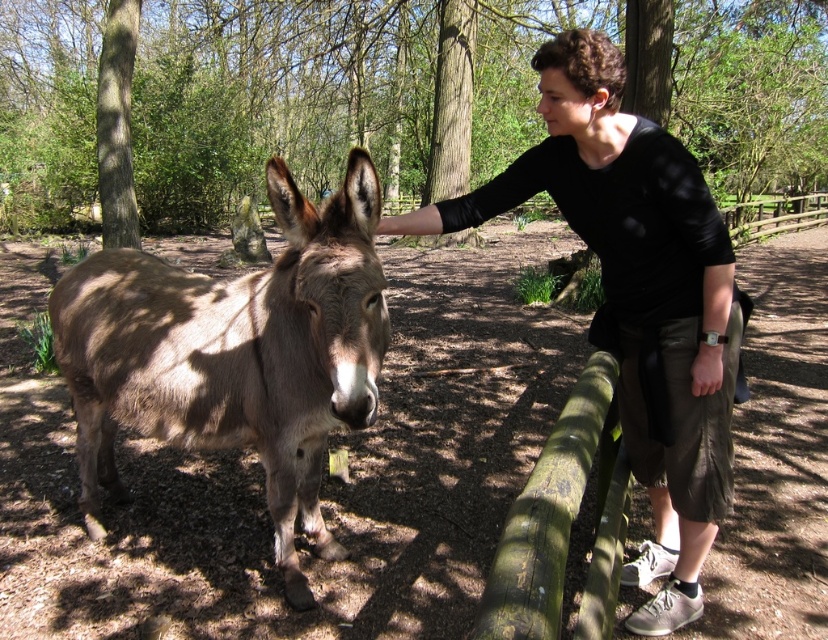
Describe the element at coordinates (234, 355) in the screenshot. This screenshot has height=640, width=828. I see `brown textured donkey at center` at that location.

Can you confirm if brown textured donkey at center is positioned above black cotton shirt at upper right?

Actually, brown textured donkey at center is below black cotton shirt at upper right.

What do you see at coordinates (234, 355) in the screenshot? This screenshot has height=640, width=828. I see `brown textured donkey at center` at bounding box center [234, 355].

Find the location of a particular element. The height and width of the screenshot is (640, 828). brown textured donkey at center is located at coordinates (234, 355).